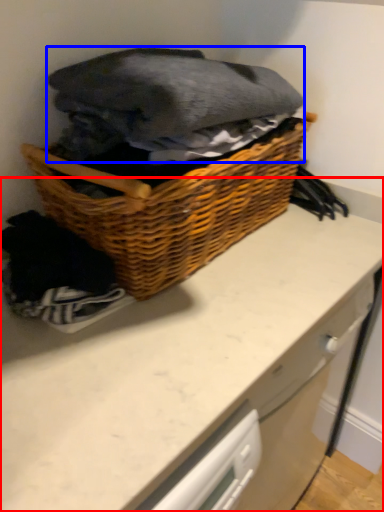
Question: Among these objects, which one is nearest to the camera, counter (highlighted by a red box) or clothing (highlighted by a blue box)?

Choices:
 (A) counter
 (B) clothing

Answer: (B)